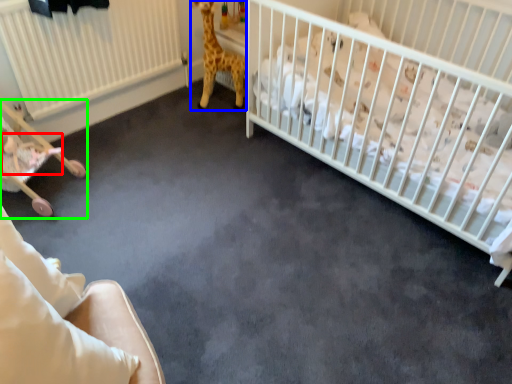
Question: Which object is positioned farthest from newborn (highlighted by a red box)? Select from giraffe (highlighted by a blue box) and baby carriage (highlighted by a green box).

Choices:
 (A) giraffe
 (B) baby carriage

Answer: (A)